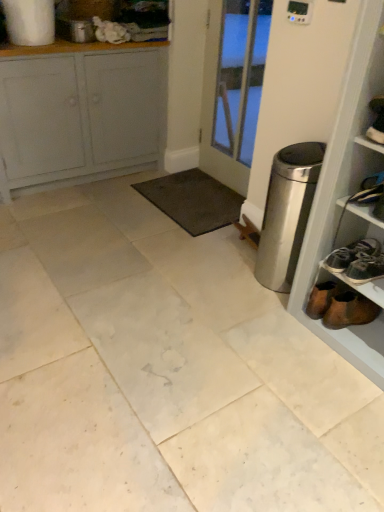
Where is `white painted wood cabinet at upper left`? white painted wood cabinet at upper left is located at coordinates click(x=79, y=114).

Measure the distance between point (303, 158) and camera.

Point (303, 158) is 6.39 feet away from camera.

The width and height of the screenshot is (384, 512). What do you see at coordinates (287, 213) in the screenshot? I see `stainless steel trash can at right` at bounding box center [287, 213].

Image resolution: width=384 pixels, height=512 pixels. Find the location of `brown suede boot at lower right`. brown suede boot at lower right is located at coordinates (349, 310).

The width and height of the screenshot is (384, 512). What are the coordinates of `white marble tile at center` in the screenshot? It's located at (165, 371).

At what (x,y) coordinates should I click in order to perform the action: click on white painted wood cabinet at upper left. Please return your answer as a coordinate pair (x, y). This screenshot has height=512, width=384. Looking at the image, I should click on (79, 114).

From the image's perspective, is stainless steel trash can at right beneath white painted wood door at center?

Correct, stainless steel trash can at right appears lower than white painted wood door at center in the image.

From a real-world perspective, which object rests below the other?

From a 3D spatial view, stainless steel trash can at right is below.

Is stainless steel trash can at right placed right next to white painted wood door at center?

No, stainless steel trash can at right is not beside white painted wood door at center.

In the image, is stainless steel trash can at right positioned in front of or behind white painted wood door at center?

Visually, stainless steel trash can at right is located in front of white painted wood door at center.

Relative to white marble tile at center, is brown suede boot at lower right in front or behind?

In the image, brown suede boot at lower right appears behind white marble tile at center.

Considering the relative sizes of brown suede boot at lower right and white marble tile at center in the image provided, is brown suede boot at lower right smaller than white marble tile at center?

Yes, brown suede boot at lower right is smaller than white marble tile at center.

From the picture: Is brown suede boot at lower right oriented towards white marble tile at center?

No, brown suede boot at lower right is not oriented towards white marble tile at center.

Consider the image. Do you think brown suede boot at lower right is within white marble tile at center, or outside of it?

brown suede boot at lower right is not inside white marble tile at center, it's outside.

Does white marble tile at center have a lesser width compared to white painted wood cabinet at upper left?

In fact, white marble tile at center might be wider than white painted wood cabinet at upper left.

From the image's perspective, is white marble tile at center under white painted wood cabinet at upper left?

Yes.

Is white marble tile at center touching white painted wood cabinet at upper left?

They are not placed beside each other.

Is white painted wood cabinet at upper left a part of dark gray carpet at center?

No, white painted wood cabinet at upper left is not a part of dark gray carpet at center.

Is dark gray carpet at center next to white painted wood cabinet at upper left?

No, dark gray carpet at center is not touching white painted wood cabinet at upper left.

From a real-world perspective, who is located higher, dark gray carpet at center or white painted wood cabinet at upper left?

white painted wood cabinet at upper left.

Between stainless steel trash can at right and white marble tile at center, which one appears on the right side from the viewer's perspective?

From the viewer's perspective, stainless steel trash can at right appears more on the right side.

Can you confirm if stainless steel trash can at right is shorter than white marble tile at center?

Incorrect, the height of stainless steel trash can at right does not fall short of that of white marble tile at center.

From a real-world perspective, does stainless steel trash can at right stand above white marble tile at center?

Correct, in the physical world, stainless steel trash can at right is higher than white marble tile at center.

Looking at the image, does stainless steel trash can at right seem bigger or smaller compared to white marble tile at center?

stainless steel trash can at right is smaller than white marble tile at center.

From the image's perspective, which is below, white marble tile at center or stainless steel trash can at right?

From the image's view, white marble tile at center is below.

Is white marble tile at center completely or partially outside of stainless steel trash can at right?

Absolutely, white marble tile at center is external to stainless steel trash can at right.

Is white marble tile at center turned away from stainless steel trash can at right?

No, white marble tile at center is not facing away from stainless steel trash can at right.

How distant is white marble tile at center from stainless steel trash can at right?

24.95 inches.

Is white marble tile at center oriented towards dark gray carpet at center?

No, white marble tile at center is not turned towards dark gray carpet at center.

Which object is positioned more to the right, white marble tile at center or dark gray carpet at center?

dark gray carpet at center is more to the right.

At what (x,y) coordinates should I click in order to perform the action: click on mat that is behind the white marble tile at center. Please return your answer as a coordinate pair (x, y). Image resolution: width=384 pixels, height=512 pixels. Looking at the image, I should click on (193, 200).

The width and height of the screenshot is (384, 512). Identify the location of appliance below the white painted wood door at center (from the image's perspective). (287, 213).

I want to click on footwear behind the white marble tile at center, so click(349, 310).

Based on their spatial positions, is white painted wood door at center or dark gray carpet at center closer to white painted wood cabinet at upper left?

The object closer to white painted wood cabinet at upper left is dark gray carpet at center.

Which object lies further to the anchor point brown suede boot at lower right, white painted wood door at center or white painted wood cabinet at upper left?

white painted wood cabinet at upper left.

Based on their spatial positions, is stainless steel trash can at right or white marble tile at center closer to white painted wood cabinet at upper left?

white marble tile at center is closer to white painted wood cabinet at upper left.

Considering their positions, is white painted wood cabinet at upper left positioned further to stainless steel trash can at right than brown suede boot at lower right?

white painted wood cabinet at upper left.

Estimate the real-world distances between objects in this image. Which object is further from white painted wood cabinet at upper left, dark gray carpet at center or stainless steel trash can at right?

The object further to white painted wood cabinet at upper left is stainless steel trash can at right.

When comparing their distances from dark gray carpet at center, does brown suede boot at lower right or white marble tile at center seem closer?

white marble tile at center lies closer to dark gray carpet at center than the other object.

Considering their positions, is dark gray carpet at center positioned closer to white painted wood door at center than white painted wood cabinet at upper left?

dark gray carpet at center is positioned closer to the anchor white painted wood door at center.

Looking at the image, which one is located closer to white painted wood cabinet at upper left, brown suede boot at lower right or stainless steel trash can at right?

The object closer to white painted wood cabinet at upper left is stainless steel trash can at right.

Where is `appliance positioned between white marble tile at center and dark gray carpet at center from near to far`? Image resolution: width=384 pixels, height=512 pixels. appliance positioned between white marble tile at center and dark gray carpet at center from near to far is located at coordinates (287, 213).

Locate an element on the screen. This screenshot has height=512, width=384. appliance located between white painted wood cabinet at upper left and brown suede boot at lower right in the left-right direction is located at coordinates (287, 213).

Identify the location of appliance located between white marble tile at center and brown suede boot at lower right in the depth direction. (287, 213).

Image resolution: width=384 pixels, height=512 pixels. Identify the location of footwear between stainless steel trash can at right and dark gray carpet at center in the front-back direction. (349, 310).